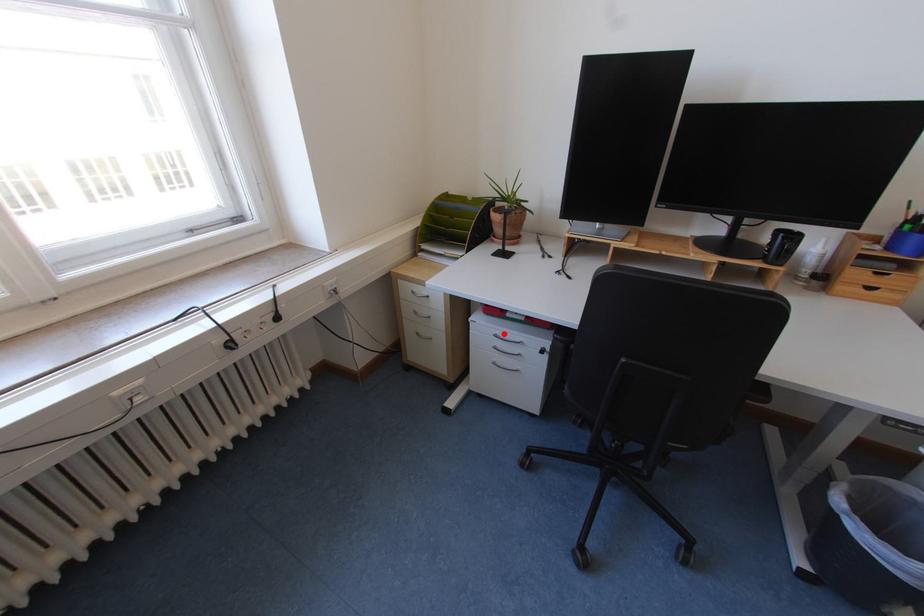
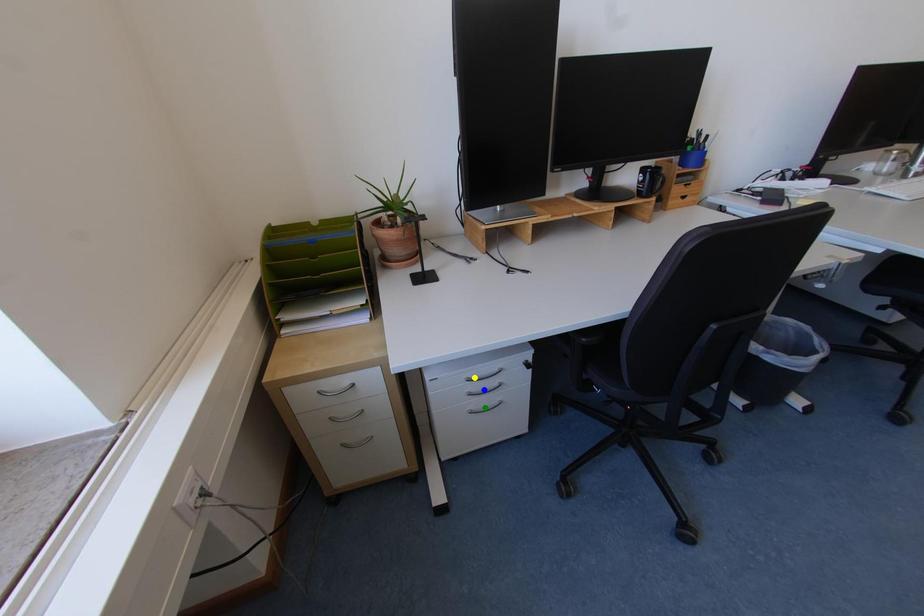
Question: I am providing you with two images of the same scene from different viewpoints. A red point is marked on the first image. You are given multiple points on the second image. Which point in image 2 represents the same 3d spot as the red point in image 1?

Choices:
 (A) green point
 (B) yellow point
 (C) blue point

Answer: (B)